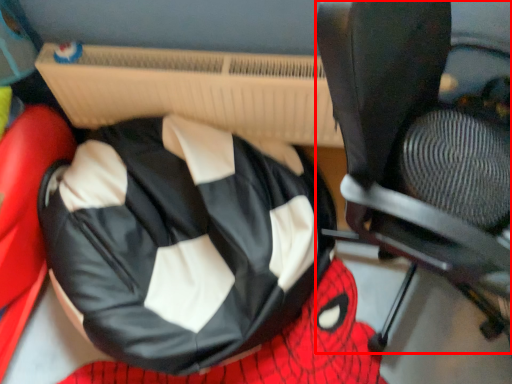
Question: From the image, what is the correct spatial relationship of chair (annotated by the red box) in relation to bean bag chair?

Choices:
 (A) right
 (B) left

Answer: (A)